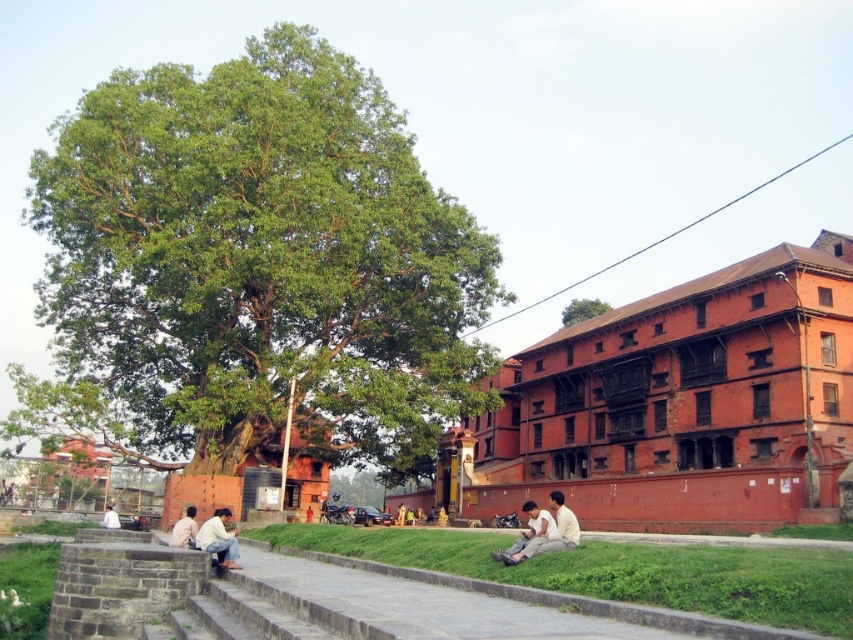
Who is more distant from viewer, (508, 580) or (109, 509)?

The point (109, 509) is more distant.

Describe the element at coordinates (619, 570) in the screenshot. I see `green grass at lower center` at that location.

Is point (302, 524) behind point (108, 513)?

No, it is not.

Find the location of a particular element. The height and width of the screenshot is (640, 853). green grass at lower center is located at coordinates (619, 570).

Does green grass at lower left lie behind light brown wooden bench at lower center?

No, it is not.

Locate an element on the screen. This screenshot has width=853, height=640. green grass at lower left is located at coordinates (26, 588).

The width and height of the screenshot is (853, 640). What are the coordinates of `green grass at lower left` in the screenshot? It's located at (26, 588).

Is green grass at lower center closer to the viewer compared to white fabric shirt at lower center?

Yes, it is in front of white fabric shirt at lower center.

How distant is green grass at lower center from white fabric shirt at lower center?

green grass at lower center is 21.03 meters from white fabric shirt at lower center.

Locate an element on the screen. The image size is (853, 640). green grass at lower center is located at coordinates (619, 570).

At what (x,y) coordinates should I click in order to perform the action: click on green grass at lower center. Please return your answer as a coordinate pair (x, y). Looking at the image, I should click on (619, 570).